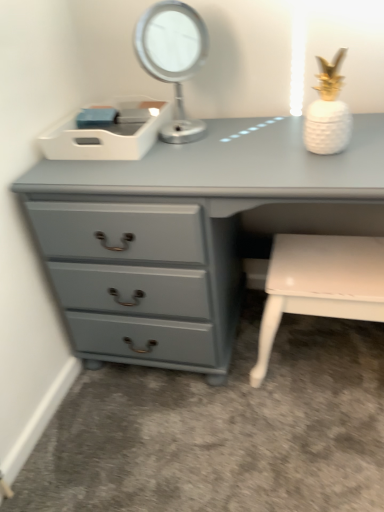
Where is `free space in front of metallic silver table lamp at upper center`? This screenshot has width=384, height=512. free space in front of metallic silver table lamp at upper center is located at coordinates (187, 157).